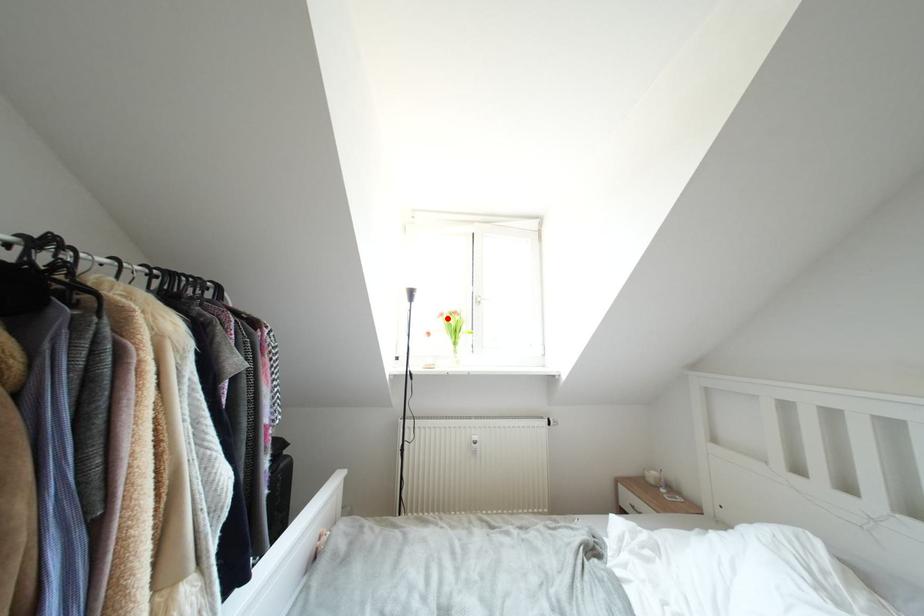
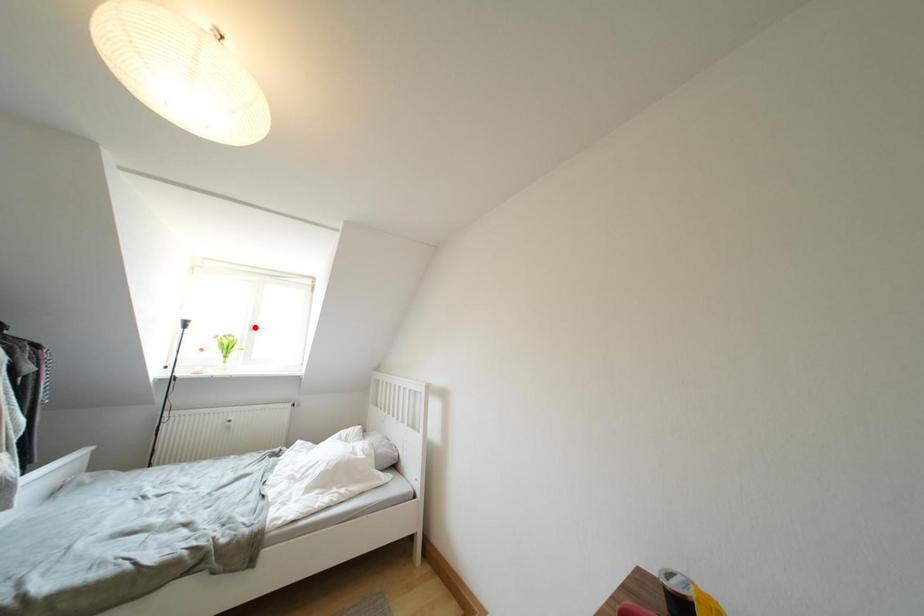
I am providing you with two images of the same scene from different viewpoints. A red point is marked on the first image and another point is marked on the second image. Does the point marked in image1 correspond to the same location as the one in image2?

No